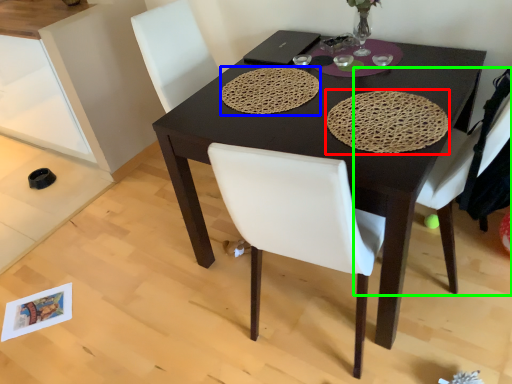
Question: Based on their relative distances, which object is nearer to mat (highlighted by a red box)? Choose from mat (highlighted by a blue box) and chair (highlighted by a green box).

Choices:
 (A) mat
 (B) chair

Answer: (B)